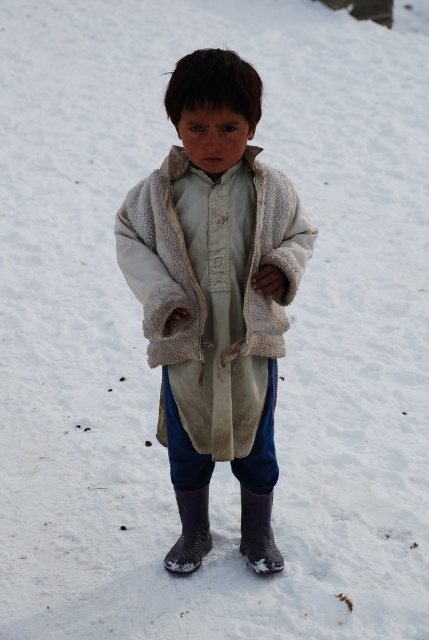
Is fuzzy beige coat at center positioned before rubber/matte boot at lower center?

Yes, fuzzy beige coat at center is in front of rubber/matte boot at lower center.

Which is in front, point (171, 193) or point (250, 529)?

Point (171, 193) is in front.

The image size is (429, 640). I want to click on fuzzy beige coat at center, so click(x=214, y=273).

Is rubber/mesh boot at lower center wider than rubber/matte boot at lower center?

Yes, rubber/mesh boot at lower center is wider than rubber/matte boot at lower center.

Which is in front, point (198, 556) or point (263, 550)?

Point (263, 550) is more forward.

Identify the location of rubber/mesh boot at lower center. (190, 531).

Can you confirm if fuzzy beige coat at center is positioned to the right of rubber/mesh boot at lower center?

Correct, you'll find fuzzy beige coat at center to the right of rubber/mesh boot at lower center.

Consider the image. Does fuzzy beige coat at center have a lesser width compared to rubber/mesh boot at lower center?

No, fuzzy beige coat at center is not thinner than rubber/mesh boot at lower center.

Does point (250, 316) come behind point (181, 493)?

No, (250, 316) is closer to viewer.

At what (x,y) coordinates should I click in order to perform the action: click on fuzzy beige coat at center. Please return your answer as a coordinate pair (x, y). Image resolution: width=429 pixels, height=640 pixels. Looking at the image, I should click on (214, 273).